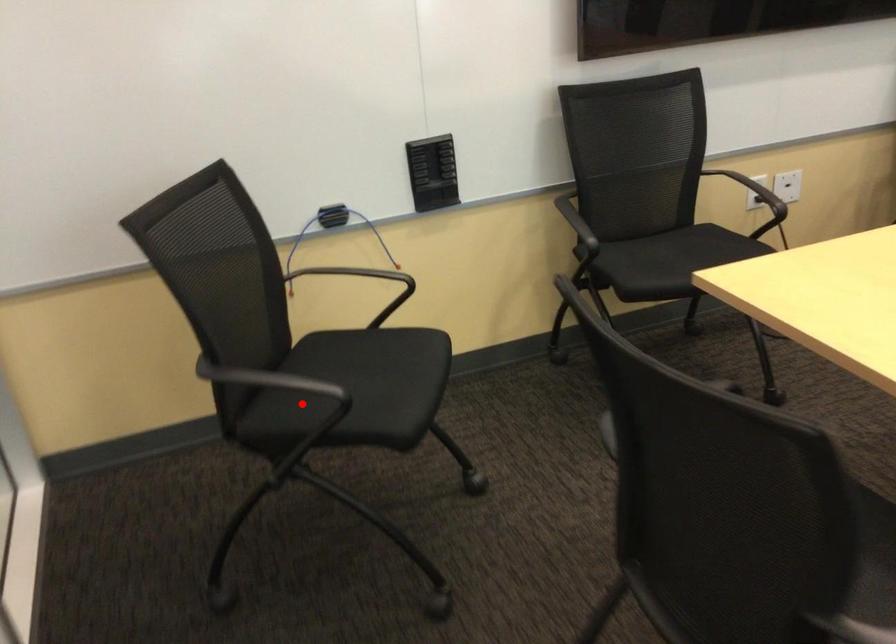
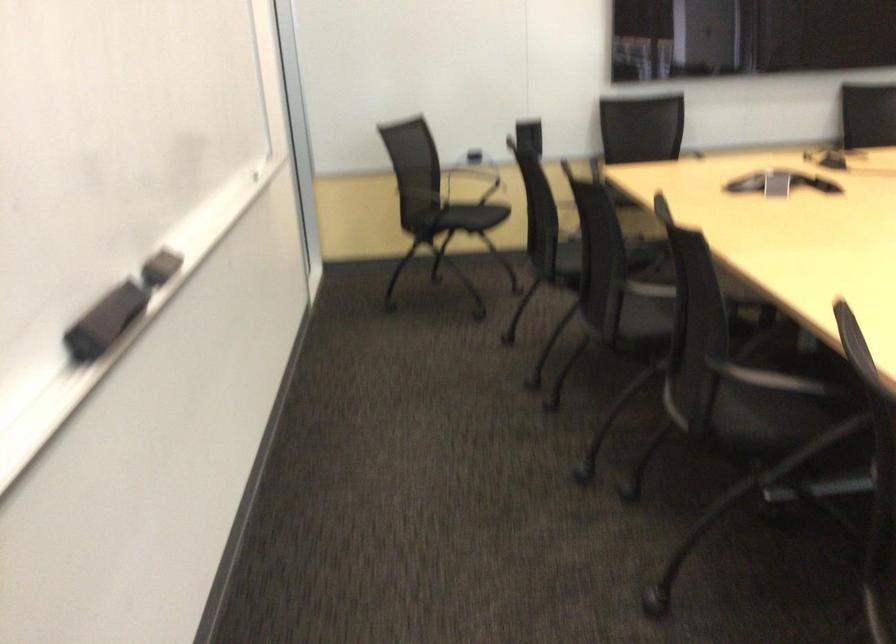
Question: I am providing you with two images of the same scene from different viewpoints. Image1 has a red point marked. In image2, the corresponding 3D location appears at what relative position? Reply with the corresponding letter.

Choices:
 (A) Closer
 (B) Farther

Answer: (B)